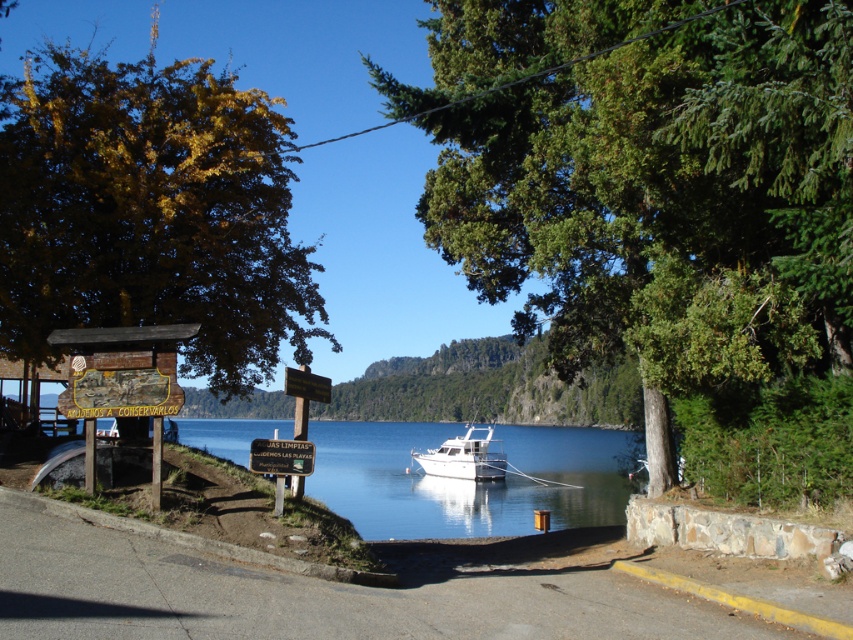
Can you confirm if yellow-green leaves at upper left is wider than clear water at center?

Yes.

Can you confirm if yellow-green leaves at upper left is shorter than clear water at center?

In fact, yellow-green leaves at upper left may be taller than clear water at center.

Where is `yellow-green leaves at upper left`? yellow-green leaves at upper left is located at coordinates (149, 212).

Locate an element on the screen. yellow-green leaves at upper left is located at coordinates (149, 212).

Does clear water at center have a lesser width compared to white glossy boat at center?

No, clear water at center is not thinner than white glossy boat at center.

Between clear water at center and white glossy boat at center, which one has more height?

clear water at center is taller.

You are a GUI agent. You are given a task and a screenshot of the screen. Output one action in this format:
    pyautogui.click(x=<x>, y=<y>)
    Task: Click on the clear water at center
    
    Given the screenshot: What is the action you would take?
    pyautogui.click(x=467, y=480)

Locate an element on the screen. This screenshot has width=853, height=640. clear water at center is located at coordinates (467, 480).

Does green leafy tree at center have a lesser height compared to yellow-green leaves at upper left?

Correct, green leafy tree at center is not as tall as yellow-green leaves at upper left.

Describe the element at coordinates (659, 202) in the screenshot. This screenshot has height=640, width=853. I see `green leafy tree at center` at that location.

Image resolution: width=853 pixels, height=640 pixels. In order to click on green leafy tree at center in this screenshot , I will do `click(659, 202)`.